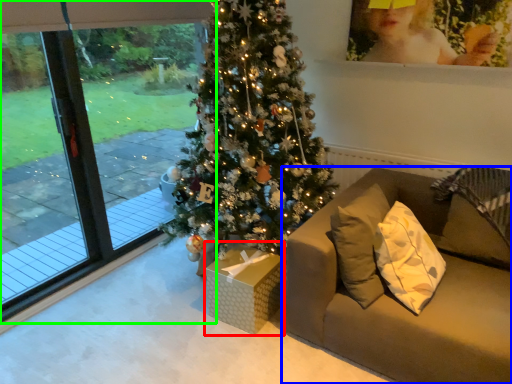
Question: Which is farther away from furniture (highlighted by a red box)? studio couch (highlighted by a blue box) or window (highlighted by a green box)?

Choices:
 (A) studio couch
 (B) window

Answer: (B)